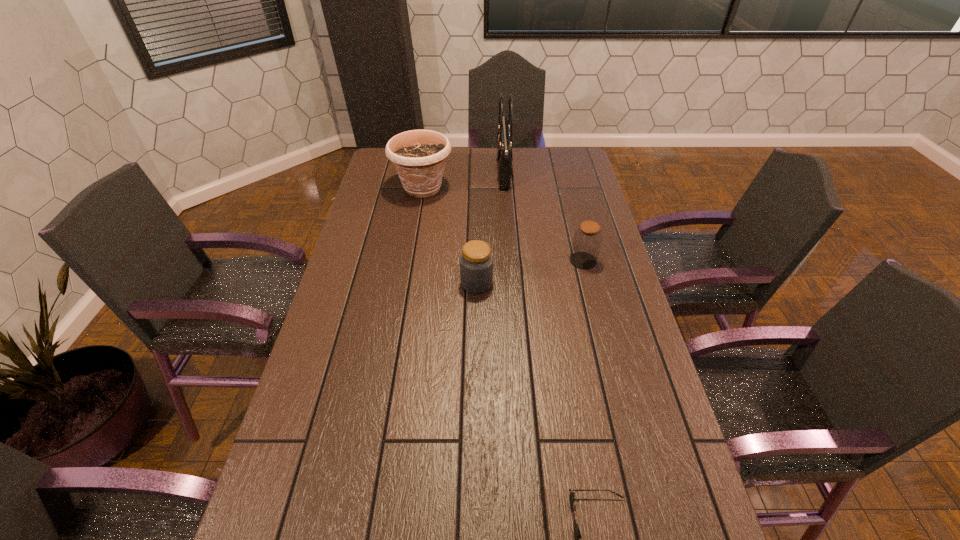
This screenshot has height=540, width=960. I want to click on vacant area located with an open clasp on the front of the third object from left to right, so click(x=413, y=172).

What are the coordinates of `vacant region located on the right of the fourth shortest object` in the screenshot? It's located at (540, 189).

You are a GUI agent. You are given a task and a screenshot of the screen. Output one action in this format:
    pyautogui.click(x=<x>, y=<y>)
    Task: Click on the free space located on the surface of the left jar near the warning symbol
    The height and width of the screenshot is (540, 960).
    Given the screenshot: What is the action you would take?
    pyautogui.click(x=550, y=283)

At what (x,y) coordinates should I click in order to perform the action: click on free space located on the back of the third nearest object. Please return your answer as a coordinate pair (x, y). This screenshot has height=540, width=960. Looking at the image, I should click on (576, 233).

The image size is (960, 540). Identify the location of handbag at the far edge. [x=504, y=134].

The width and height of the screenshot is (960, 540). Find the location of `flowerpot that is at the far edge`. flowerpot that is at the far edge is located at coordinates (419, 156).

The width and height of the screenshot is (960, 540). I want to click on object that is at the left edge, so click(x=419, y=156).

Where is `object that is at the right edge`? This screenshot has height=540, width=960. object that is at the right edge is located at coordinates (587, 240).

Where is `object present at the far left corner`? The width and height of the screenshot is (960, 540). object present at the far left corner is located at coordinates (419, 156).

Identify the location of free spot at the left edge of the desktop. The height and width of the screenshot is (540, 960). (372, 210).